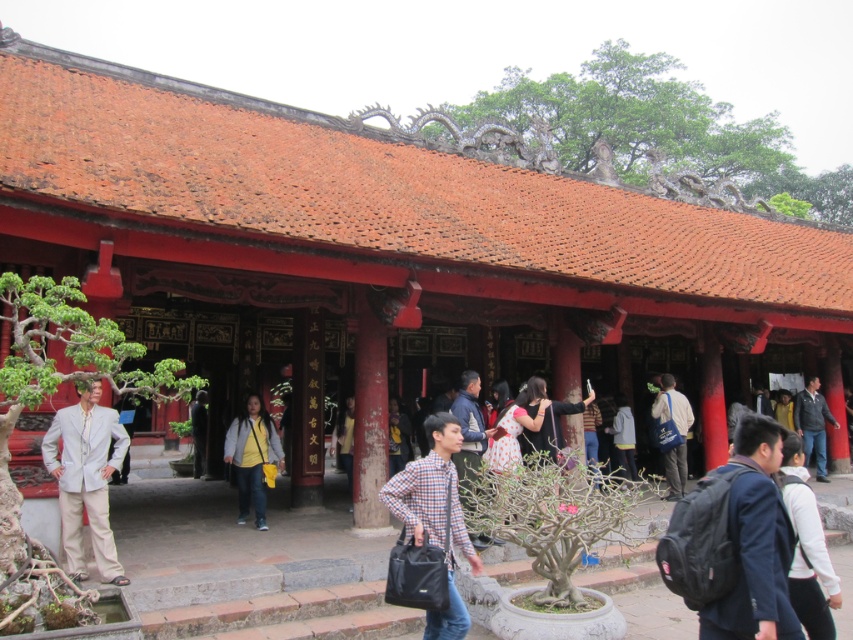
Question: Which point is farther from the camera taking this photo?

Choices:
 (A) (663, 416)
 (B) (791, 413)
 (C) (442, 422)
 (D) (329, 448)

Answer: (D)

Question: Is checkered fabric shirt at center to the left of blue fabric bag at center-right from the viewer's perspective?

Choices:
 (A) no
 (B) yes

Answer: (B)

Question: Which point is closer to the camera?

Choices:
 (A) (815, 593)
 (B) (688, 429)
 (C) (785, 426)
 (D) (250, 429)

Answer: (A)

Question: Which object is positioned farthest from the checkered fabric shirt at center?

Choices:
 (A) gray fleece jacket at center
 (B) yellow fabric backpack at center

Answer: (A)

Question: Does checkered fabric shirt at center appear over yellow fabric at center?

Choices:
 (A) yes
 (B) no

Answer: (A)

Question: Is checkered fabric shirt at center below white cotton shirt at center?

Choices:
 (A) no
 (B) yes

Answer: (B)